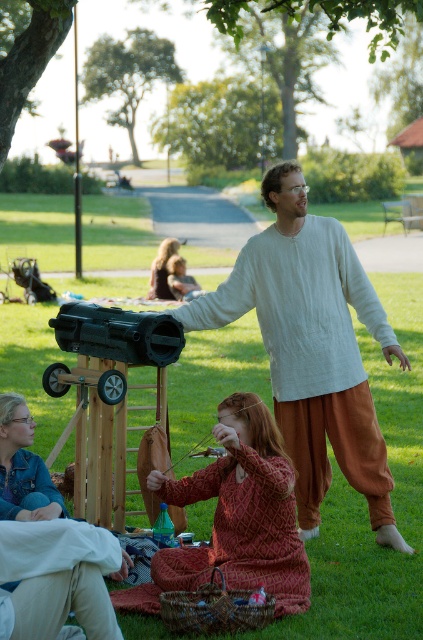
Question: Which object is positioned closest to the green grass at center?

Choices:
 (A) light beige linen shirt at center
 (B) denim jacket at lower left
 (C) red textured dress at center

Answer: (C)

Question: Is the position of green grass at center less distant than that of red textured dress at center?

Choices:
 (A) no
 (B) yes

Answer: (B)

Question: Among these objects, which one is farthest from the camera?

Choices:
 (A) red textured dress at center
 (B) light beige linen shirt at center
 (C) blonde hair at center

Answer: (C)

Question: Can you confirm if denim jacket at lower left is thinner than blonde hair at center?

Choices:
 (A) no
 (B) yes

Answer: (B)

Question: Based on their relative distances, which object is nearer to the denim jacket at lower left?

Choices:
 (A) light beige linen shirt at center
 (B) red textured dress at center
 (C) blonde hair at center
 (D) green grass at center

Answer: (B)

Question: Does light beige linen shirt at center have a larger size compared to red textured dress at center?

Choices:
 (A) no
 (B) yes

Answer: (B)